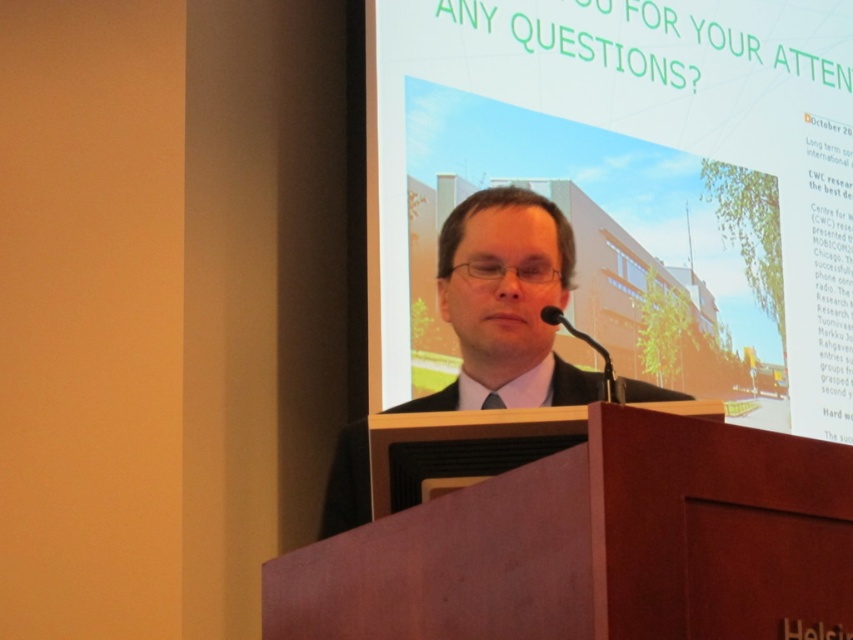
Is point (833, 540) positioned after point (480, 404)?

No.

Who is shorter, brown wood podium at center or black satin tie at center?

black satin tie at center

Does point (492, 483) come behind point (485, 401)?

No, it is in front of (485, 401).

This screenshot has height=640, width=853. In order to click on brown wood podium at center in this screenshot , I will do `click(583, 532)`.

Between black suit at center and black satin tie at center, which one has more height?

With more height is black suit at center.

Is black suit at center wider than black satin tie at center?

Indeed, black suit at center has a greater width compared to black satin tie at center.

At what (x,y) coordinates should I click in order to perform the action: click on black suit at center. Please return your answer as a coordinate pair (x, y). Looking at the image, I should click on (506, 301).

Locate an element on the screen. black suit at center is located at coordinates (506, 301).

Who is positioned more to the left, brown wood podium at center or black suit at center?

Positioned to the left is brown wood podium at center.

From the picture: Is brown wood podium at center taller than black suit at center?

A: No, brown wood podium at center is not taller than black suit at center.

Identify the location of brown wood podium at center. pyautogui.click(x=583, y=532).

Where is `brown wood podium at center`? brown wood podium at center is located at coordinates (583, 532).